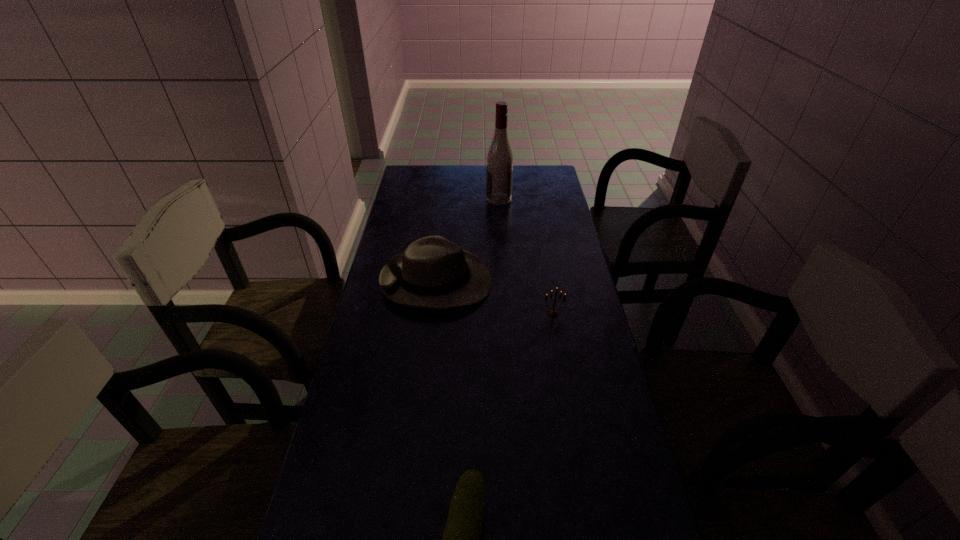
The image size is (960, 540). What are the coordinates of `alcohol` in the screenshot? It's located at (499, 175).

This screenshot has width=960, height=540. I want to click on the tallest object, so click(499, 175).

The height and width of the screenshot is (540, 960). What are the coordinates of `fedora` in the screenshot? It's located at (433, 273).

In order to click on the rightmost object in this screenshot , I will do `click(553, 313)`.

The image size is (960, 540). I want to click on free space located 0.210m on the label of the tallest object, so click(x=438, y=199).

Locate an element on the screen. The width and height of the screenshot is (960, 540). free point located on the label of the tallest object is located at coordinates (396, 199).

Locate an element on the screen. This screenshot has width=960, height=540. vacant space situated on the label of the tallest object is located at coordinates (416, 199).

Locate an element on the screen. The height and width of the screenshot is (540, 960). vacant space situated 0.160m on the front-facing side of the third shortest object is located at coordinates (539, 281).

Identify the location of vacant space located on the back of the candelabrum. (540, 238).

Locate an element on the screen. This screenshot has width=960, height=540. object that is at the left edge is located at coordinates (433, 273).